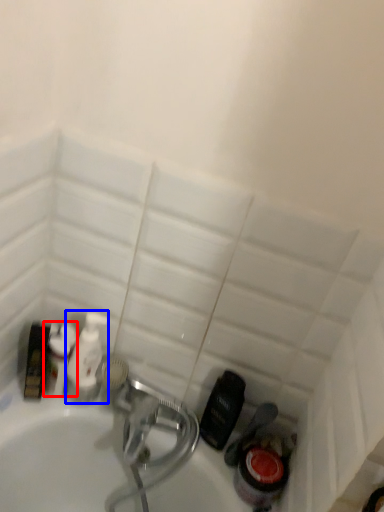
Question: Which point is further to the camera, cleaning product (highlighted by a red box) or cleaning product (highlighted by a blue box)?

Choices:
 (A) cleaning product
 (B) cleaning product

Answer: (B)